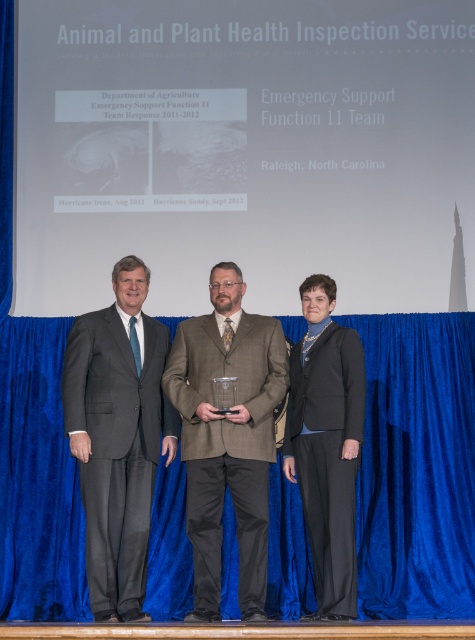
You are an event photographer at the stage. You need to capture a closeup shot of the brown wool suit at center. According to the 2D coordinates provided, where exactly should you focus your camera?

The brown wool suit at center is located at the 2D coordinates point (227, 436). So, you should focus your camera at point (227, 436) to capture the closeup shot.

You are an event photographer standing in the audience. You want to capture a closeup shot of the blue velvet curtain at center. Which direction should you move to get closer to it?

The blue velvet curtain at center is located at point [416,467] in the image. Since you are in the audience, you should move forward towards the stage to get closer to the blue velvet curtain at center.